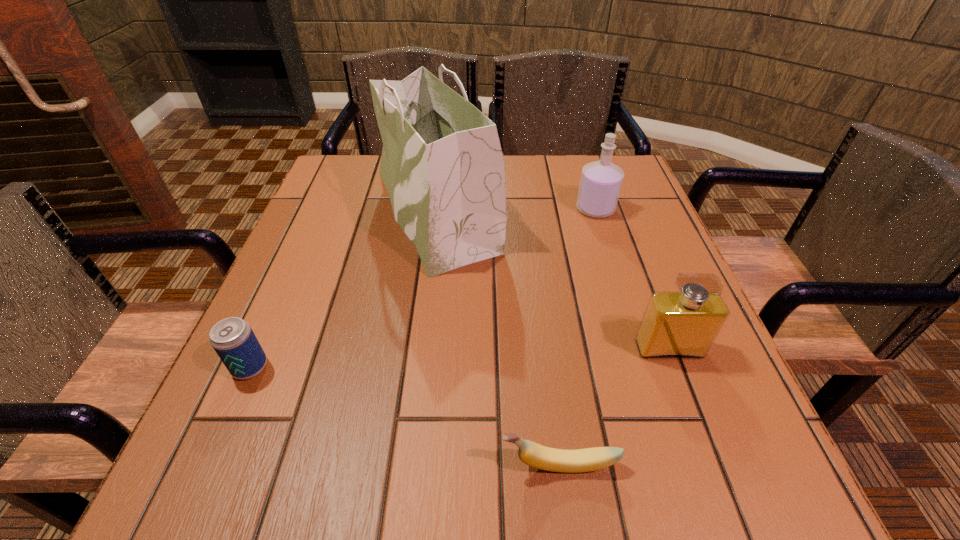
Where is `object that is at the far right corner`? The image size is (960, 540). object that is at the far right corner is located at coordinates (600, 184).

This screenshot has width=960, height=540. In order to click on free space at the far edge of the desktop in this screenshot , I will do `click(514, 170)`.

Find the location of a particular element. The image size is (960, 540). vacant area at the near edge of the desktop is located at coordinates (604, 482).

Where is `free space at the left edge of the desktop`? free space at the left edge of the desktop is located at coordinates (374, 210).

Locate an element on the screen. The image size is (960, 540). vacant space at the right edge of the desktop is located at coordinates (622, 229).

Locate an element on the screen. The width and height of the screenshot is (960, 540). free region at the far left corner of the desktop is located at coordinates (350, 179).

In the image, there is a desktop. Where is `free space at the near right corner`? free space at the near right corner is located at coordinates (692, 447).

You are a GUI agent. You are given a task and a screenshot of the screen. Output one action in this format:
    pyautogui.click(x=<x>, y=<y>)
    Task: Click on the empty space that is in between the nearest object and the tallest object
    
    Given the screenshot: What is the action you would take?
    coord(497,337)

Find the location of a particular element. The width and height of the screenshot is (960, 540). vacant area between the leftmost object and the farther perfume is located at coordinates (422, 288).

Locate an element on the screen. The height and width of the screenshot is (540, 960). free point between the farther perfume and the shortest object is located at coordinates (577, 337).